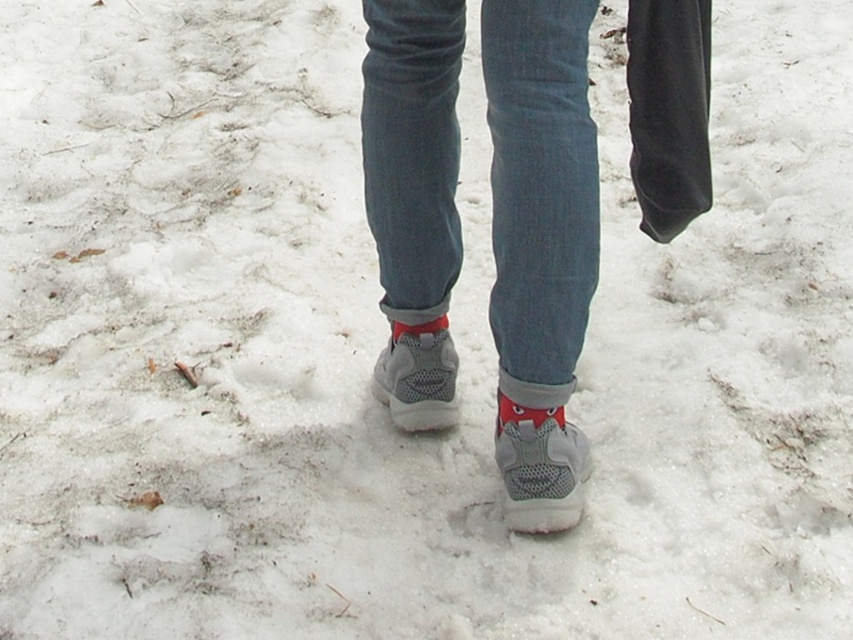
Based on the photo, can you confirm if denim at center is positioned above red suede sock at lower center?

Yes, denim at center is above red suede sock at lower center.

Between denim at center and red suede sock at lower center, which one is positioned lower?

red suede sock at lower center

Describe the element at coordinates (540, 180) in the screenshot. I see `denim at center` at that location.

This screenshot has height=640, width=853. I want to click on denim at center, so click(540, 180).